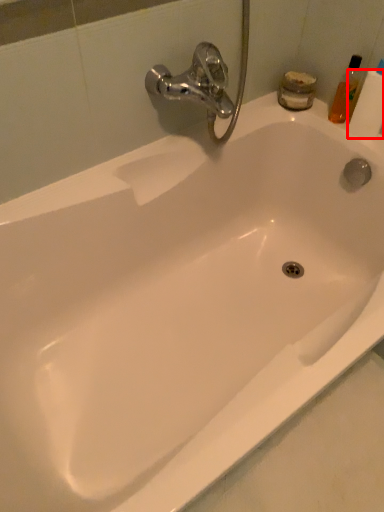
Question: From the image's perspective, where is toilet paper (annotated by the red box) located in relation to toiletry in the image?

Choices:
 (A) above
 (B) below

Answer: (B)